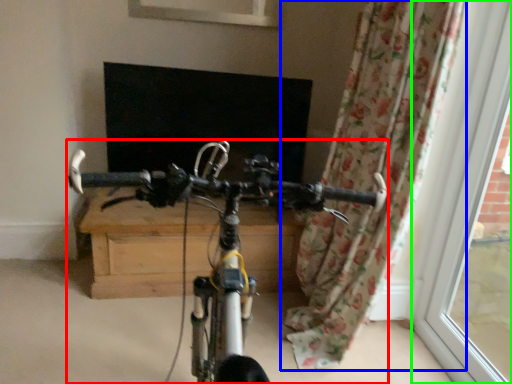
Question: Which object is positioned farthest from bicycle (highlighted by a red box)? Select from curtain (highlighted by a blue box) and window frame (highlighted by a green box).

Choices:
 (A) curtain
 (B) window frame

Answer: (B)